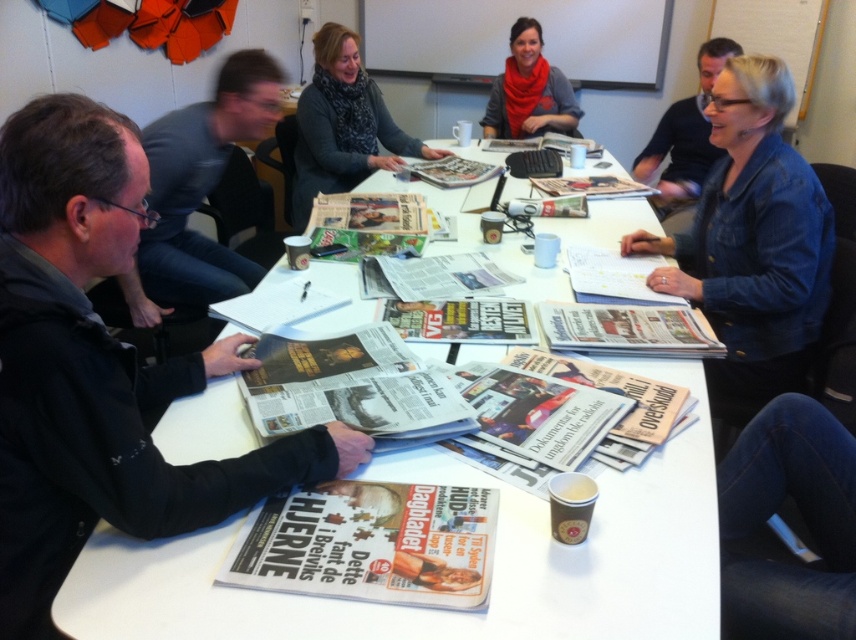
Question: Which of the following is the closest to the observer?

Choices:
 (A) denim jacket at upper right
 (B) matte black jacket at left
 (C) red scarf at upper center

Answer: (A)

Question: Which object appears closest to the camera in this image?

Choices:
 (A) black fabric jacket at lower left
 (B) blue denim jacket at upper right
 (C) white paper at center
 (D) denim jacket at upper right

Answer: (C)

Question: From the image, what is the correct spatial relationship of black fabric jacket at lower left in relation to knitted scarf at upper center?

Choices:
 (A) below
 (B) above

Answer: (A)

Question: Among these points, which one is nearest to the camera?

Choices:
 (A) coord(524,99)
 (B) coord(138,253)
 (C) coord(270,472)
 (D) coord(378,128)

Answer: (C)

Question: Is denim jeans at lower right above knitted scarf at upper center?

Choices:
 (A) yes
 (B) no

Answer: (B)

Question: From the image, what is the correct spatial relationship of white paper at center in relation to blue denim jacket at upper right?

Choices:
 (A) right
 (B) left

Answer: (B)